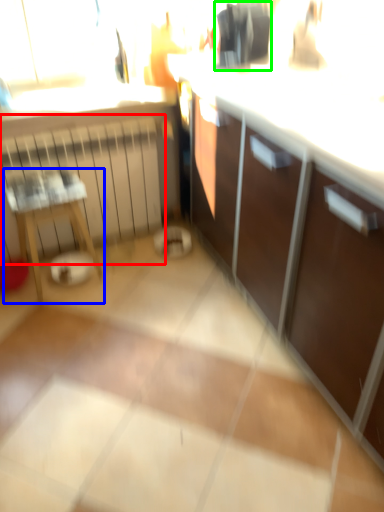
Question: Which object is the closest to the radiator (highlighted by a red box)? Choose among these: furniture (highlighted by a blue box) or appliance (highlighted by a green box).

Choices:
 (A) furniture
 (B) appliance

Answer: (A)